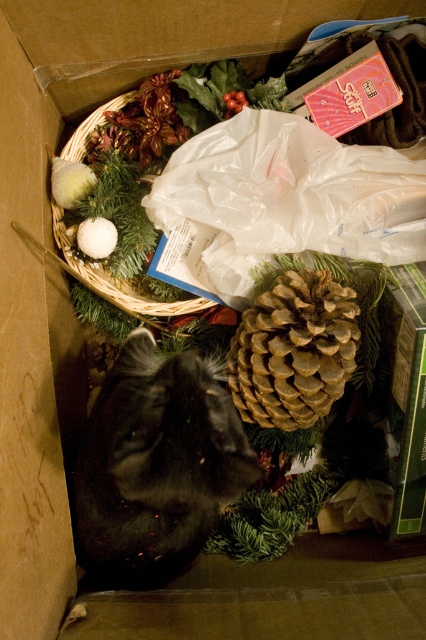
Find the location of a particular element. black fluffy cat at lower left is located at coordinates (155, 465).

Measure the distance from black fluffy cat at lower left to woven straw basket at upper left.

black fluffy cat at lower left is 22.79 centimeters away from woven straw basket at upper left.

Who is more distant from viewer, (238, 490) or (131, 93)?

Positioned behind is point (131, 93).

I want to click on black fluffy cat at lower left, so click(x=155, y=465).

The image size is (426, 640). What do you see at coordinates (293, 349) in the screenshot?
I see `brown textured pine cone at center` at bounding box center [293, 349].

Does point (296, 346) come in front of point (124, 96)?

Yes, it is.

Who is more forward, [255,417] or [74,260]?

Positioned in front is point [255,417].

This screenshot has width=426, height=640. Find the location of `brown textured pine cone at center`. brown textured pine cone at center is located at coordinates (293, 349).

Can you confirm if black fluffy cat at lower left is positioned to the left of brown textured pine cone at center?

Indeed, black fluffy cat at lower left is positioned on the left side of brown textured pine cone at center.

Which of these two, black fluffy cat at lower left or brown textured pine cone at center, stands taller?

black fluffy cat at lower left is taller.

Does point (221, 506) come closer to viewer compared to point (279, 356)?

No, (221, 506) is behind (279, 356).

Locate an element on the screen. Image resolution: width=426 pixels, height=640 pixels. black fluffy cat at lower left is located at coordinates (155, 465).